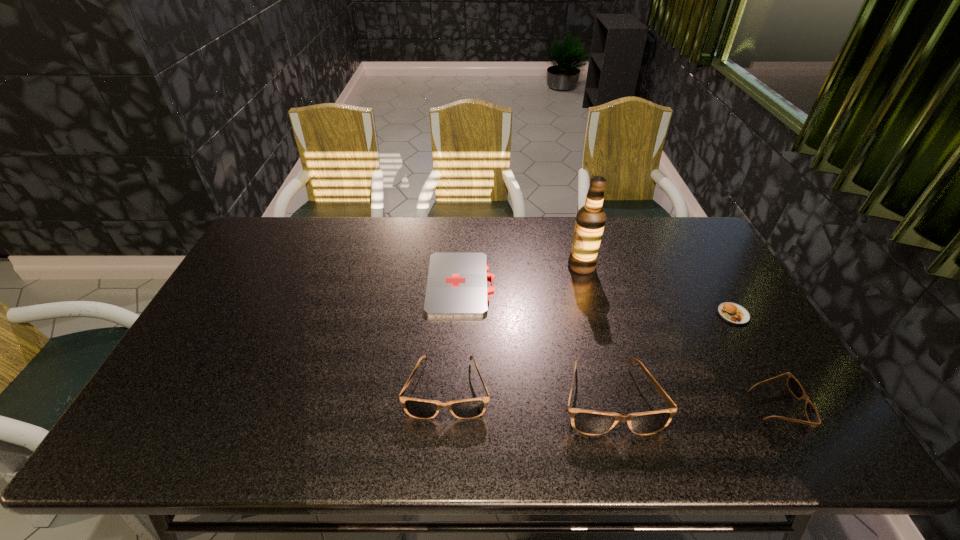
Locate an element on the screen. blank area located 0.170m on the label of the tallest object is located at coordinates (516, 266).

Image resolution: width=960 pixels, height=540 pixels. What are the coordinates of `vacant space located 0.360m on the label of the tallest object` in the screenshot? It's located at (458, 266).

Locate an element on the screen. the first-aid kit that is at the far edge is located at coordinates (456, 286).

You are a GUI agent. You are given a task and a screenshot of the screen. Output one action in this format:
    pyautogui.click(x=<x>, y=<y>)
    Task: Click on the alcohol located in the far edge section of the desktop
    The height and width of the screenshot is (540, 960).
    Given the screenshot: What is the action you would take?
    pyautogui.click(x=590, y=220)

Locate an element on the screen. Image resolution: width=960 pixels, height=540 pixels. sunglasses present at the right edge is located at coordinates (794, 386).

Where is `patty that is at the right edge`? The width and height of the screenshot is (960, 540). patty that is at the right edge is located at coordinates (732, 313).

I want to click on object present at the near right corner, so click(794, 386).

Image resolution: width=960 pixels, height=540 pixels. I want to click on free space at the far edge of the desktop, so click(636, 219).

Locate an element on the screen. The image size is (960, 540). vacant area at the near edge is located at coordinates (446, 394).

Find the location of a particular element. The image size is (960, 540). free space at the right edge of the desktop is located at coordinates (758, 381).